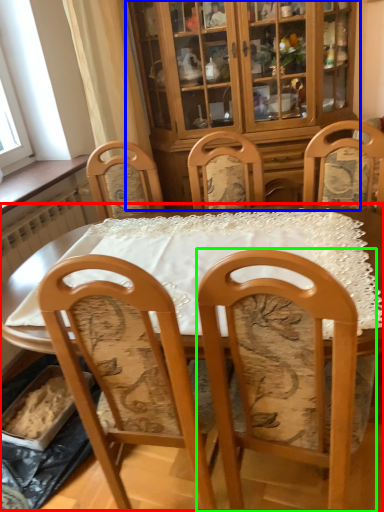
Question: Which object is the farthest from table (highlighted by a red box)? Choose among these: cabinetry (highlighted by a blue box) or chair (highlighted by a green box).

Choices:
 (A) cabinetry
 (B) chair

Answer: (A)